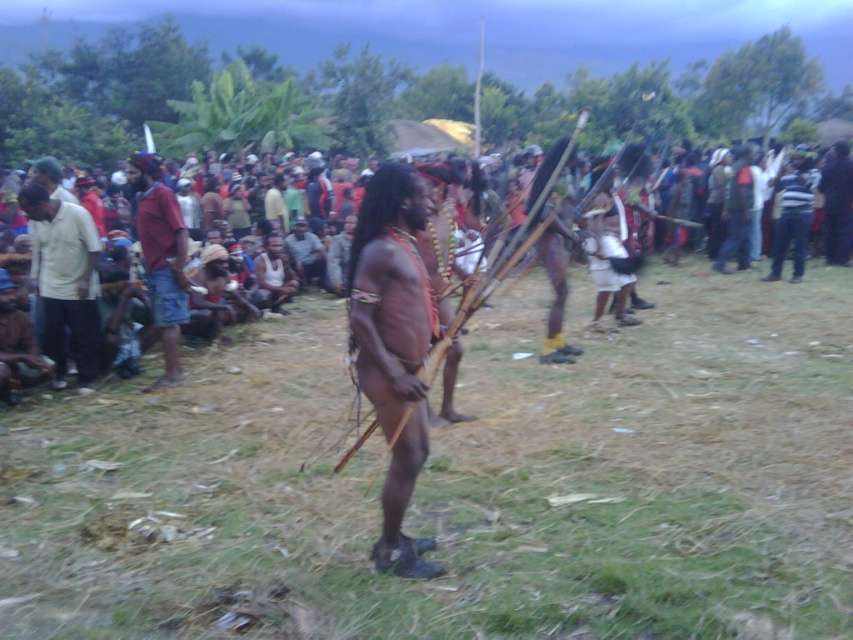
Question: Is the position of brown skin/unclothed man at center more distant than that of red fabric shirt at left?

Choices:
 (A) no
 (B) yes

Answer: (A)

Question: Is brown skin/unclothed man at center smaller than red fabric shirt at left?

Choices:
 (A) yes
 (B) no

Answer: (A)

Question: Which point appears farthest from the camera in this image?

Choices:
 (A) (73, 240)
 (B) (399, 445)
 (C) (173, 260)

Answer: (A)

Question: Estimate the real-world distances between objects in this image. Which object is closer to the red fabric shirt at left?

Choices:
 (A) brown skin/unclothed man at center
 (B) white shirt at left

Answer: (B)

Question: Among these points, which one is nearest to the camera?

Choices:
 (A) (171, 288)
 (B) (405, 292)

Answer: (B)

Question: Can you confirm if white shirt at left is bigger than red fabric shirt at left?

Choices:
 (A) yes
 (B) no

Answer: (B)